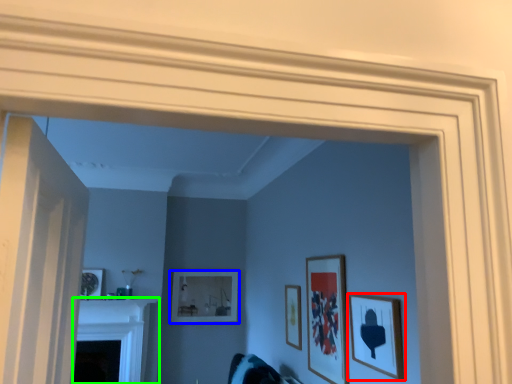
Question: Estimate the real-world distances between objects in this image. Which object is farther from picture frame (highlighted by a red box), picture frame (highlighted by a blue box) or fireplace (highlighted by a green box)?

Choices:
 (A) picture frame
 (B) fireplace

Answer: (B)